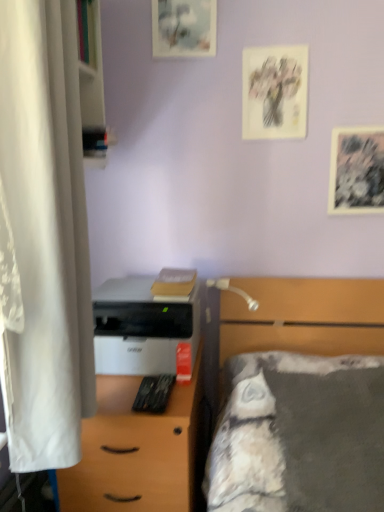
Question: Is white matte desk at center not within white wood bookshelf at left?

Choices:
 (A) yes
 (B) no

Answer: (A)

Question: Does white matte desk at center come behind white wood bookshelf at left?

Choices:
 (A) no
 (B) yes

Answer: (B)

Question: Is white matte desk at center positioned with its back to white wood bookshelf at left?

Choices:
 (A) yes
 (B) no

Answer: (B)

Question: From the image's perspective, is white matte desk at center beneath white wood bookshelf at left?

Choices:
 (A) yes
 (B) no

Answer: (A)

Question: From a real-world perspective, is white matte desk at center under white wood bookshelf at left?

Choices:
 (A) yes
 (B) no

Answer: (A)

Question: Considering their positions, is white fabric curtain at left located in front of or behind black textured paper at upper right, the first picture frame when ordered from bottom to top?

Choices:
 (A) behind
 (B) front

Answer: (B)

Question: From their relative heights in the image, would you say white fabric curtain at left is taller or shorter than black textured paper at upper right, the first picture frame when ordered from bottom to top?

Choices:
 (A) tall
 (B) short

Answer: (A)

Question: Based on their positions, is white fabric curtain at left located to the left or right of black textured paper at upper right, placed as the third picture frame when sorted from top to bottom?

Choices:
 (A) right
 (B) left

Answer: (B)

Question: From the image's perspective, is white fabric curtain at left above or below black textured paper at upper right, the third picture frame in the left-to-right sequence?

Choices:
 (A) above
 (B) below

Answer: (B)

Question: From a real-world perspective, is matte paper picture frame at upper center, marked as the first picture frame in a left-to-right arrangement, physically located above or below gray fabric bed at right?

Choices:
 (A) below
 (B) above

Answer: (B)

Question: Relative to gray fabric bed at right, is matte paper picture frame at upper center, the third picture frame ordered from the bottom, in front or behind?

Choices:
 (A) front
 (B) behind

Answer: (B)

Question: From the image's perspective, is matte paper picture frame at upper center, positioned as the 1th picture frame in top-to-bottom order, located above or below gray fabric bed at right?

Choices:
 (A) above
 (B) below

Answer: (A)

Question: Considering the positions of matte paper picture frame at upper center, marked as the third picture frame in a right-to-left arrangement, and gray fabric bed at right in the image, is matte paper picture frame at upper center, marked as the third picture frame in a right-to-left arrangement, wider or thinner than gray fabric bed at right?

Choices:
 (A) wide
 (B) thin

Answer: (B)

Question: In terms of height, does gray fabric bed at right look taller or shorter compared to white matte desk at center?

Choices:
 (A) tall
 (B) short

Answer: (B)

Question: Relative to white matte desk at center, is gray fabric bed at right in front or behind?

Choices:
 (A) front
 (B) behind

Answer: (A)